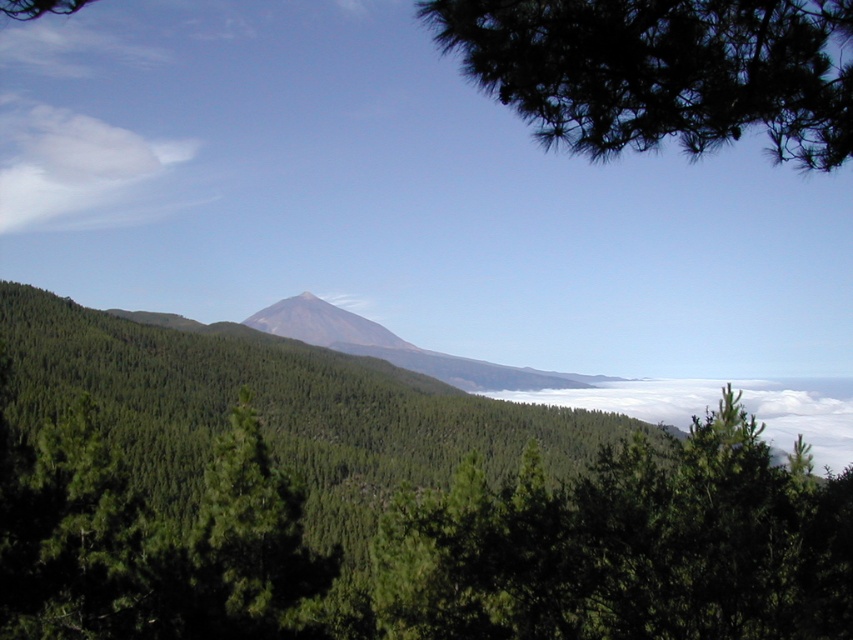
Question: Does dark green needles at upper right have a smaller size compared to white fluffy cloud at center?

Choices:
 (A) yes
 (B) no

Answer: (A)

Question: Estimate the real-world distances between objects in this image. Which object is closer to the green leafy tree at center?

Choices:
 (A) white fluffy cloud at center
 (B) dark green needles at upper right
 (C) smooth gray mountain at center

Answer: (B)

Question: Which object is positioned closest to the white cotton cloud at upper left?

Choices:
 (A) dark green needles at upper right
 (B) smooth gray mountain at center
 (C) white fluffy cloud at center
 (D) green leafy tree at center

Answer: (B)

Question: Which object appears farthest from the camera in this image?

Choices:
 (A) white fluffy cloud at center
 (B) dark green needles at upper right
 (C) green leafy tree at center

Answer: (A)

Question: Can you confirm if green leafy tree at center is bigger than white cotton cloud at upper left?

Choices:
 (A) no
 (B) yes

Answer: (A)

Question: Considering the relative positions of dark green needles at upper right and white cotton cloud at upper left in the image provided, where is dark green needles at upper right located with respect to white cotton cloud at upper left?

Choices:
 (A) right
 (B) left

Answer: (A)